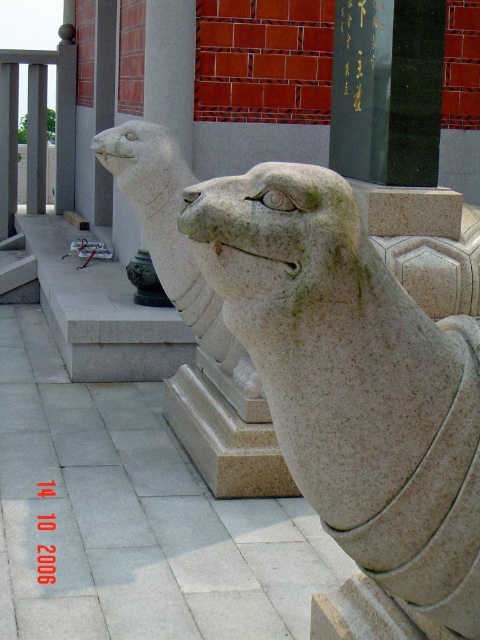
You are a delivery person carrying a box that is 1.5 meters wide. You need to pass between the granite statue at center and the gray stone lion at center. Can you fit through the space between them?

The distance between the granite statue at center and the gray stone lion at center is 1.86 meters. Since your box is 1.5 meters wide, you can fit through the space between them as the distance is wider than the box.

You are standing at the base of the two stone statues and want to place a small offering at the closest point to you between the two points marked as point [273,273] and point [149,216]. Which point should you choose?

Point [273,273] is in front of point [149,216], so you should choose point [273,273] as it is closer to you.

You are an art student analyzing the statues in the image. You need to determine which statue is smaller between the granite statue at center and the gray stone lion at center. Which one is smaller?

The granite statue at center has a smaller size compared to the gray stone lion at center, so the granite statue at center is the smaller one.